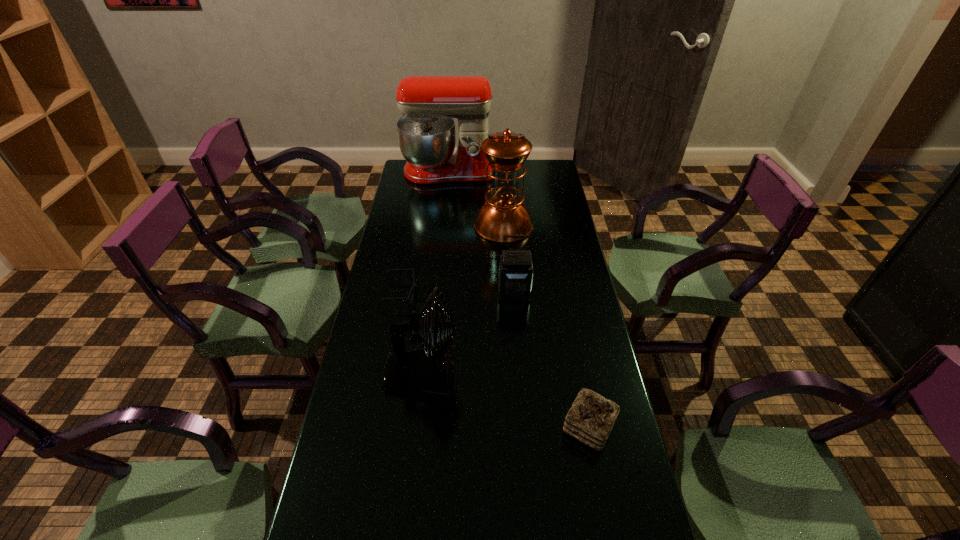
Identify the location of vacant space at the right edge. This screenshot has width=960, height=540. (598, 356).

Find the location of a particular element. The width and height of the screenshot is (960, 540). empty space between the shortest object and the second farthest object is located at coordinates (451, 259).

You are a GUI agent. You are given a task and a screenshot of the screen. Output one action in this format:
    pyautogui.click(x=<x>, y=<y>)
    Task: Click on the closest object to the second farthest object
    The width and height of the screenshot is (960, 540).
    Given the screenshot: What is the action you would take?
    pyautogui.click(x=426, y=133)

I want to click on object that is the fifth nearest to the third tallest object, so click(426, 133).

Where is `vacant area in the image that satisfies the following two spatial constraints: 1. on the front-facing side of the second shortest object; 2. on the left side of the farthest object`? This screenshot has height=540, width=960. vacant area in the image that satisfies the following two spatial constraints: 1. on the front-facing side of the second shortest object; 2. on the left side of the farthest object is located at coordinates (421, 427).

The height and width of the screenshot is (540, 960). I want to click on free space that satisfies the following two spatial constraints: 1. on the front-facing side of the mixer; 2. on the left side of the oil lamp, so click(443, 225).

I want to click on blank area in the image that satisfies the following two spatial constraints: 1. on the front-facing side of the chocolate cake; 2. on the right side of the lantern, so click(x=525, y=427).

Locate an element on the screen. vacant space that satisfies the following two spatial constraints: 1. on the front-facing side of the lantern; 2. in front of the fourth shortest object to blow air is located at coordinates (520, 374).

The width and height of the screenshot is (960, 540). Find the location of `vacant space that satisfies the following two spatial constraints: 1. on the front-facing side of the second shortest object; 2. on the right side of the spectacles`. vacant space that satisfies the following two spatial constraints: 1. on the front-facing side of the second shortest object; 2. on the right side of the spectacles is located at coordinates (374, 427).

You are a GUI agent. You are given a task and a screenshot of the screen. Output one action in this format:
    pyautogui.click(x=<x>, y=<y>)
    Task: Click on the blank area in the image that satisfies the following two spatial constraints: 1. on the front side of the second farthest object; 2. on the front-facing side of the spectacles
    This screenshot has height=540, width=960.
    Given the screenshot: What is the action you would take?
    pyautogui.click(x=508, y=293)